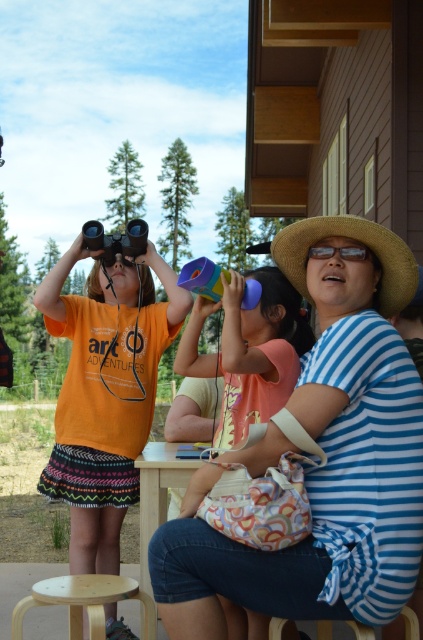
Can you confirm if blue striped shirt at center is smaller than orange matte shirt at left?

Yes.

Does point (304, 250) lie behind point (118, 342)?

No, it is in front of (118, 342).

Locate an element on the screen. This screenshot has height=640, width=423. blue striped shirt at center is located at coordinates (326, 452).

Which of these two, straw hat at right or light brown wood stool at lower left, stands taller?

With more height is straw hat at right.

How far apart are straw hat at right and light brown wood stool at lower left?

straw hat at right and light brown wood stool at lower left are 4.31 feet apart.

This screenshot has width=423, height=640. Describe the element at coordinates (354, 240) in the screenshot. I see `straw hat at right` at that location.

What are the coordinates of `straw hat at right` in the screenshot? It's located at (354, 240).

Is straw hat at right taller than wooden stool at lower center?

Yes.

Who is positioned more to the left, straw hat at right or wooden stool at lower center?

wooden stool at lower center is more to the left.

Does point (409, 282) come behind point (269, 627)?

Yes, it is.

You are a GUI agent. You are given a task and a screenshot of the screen. Output one action in this format:
    pyautogui.click(x=<x>, y=<y>)
    Task: Click on the straw hat at right
    The width and height of the screenshot is (423, 640).
    Given the screenshot: What is the action you would take?
    [354, 240]